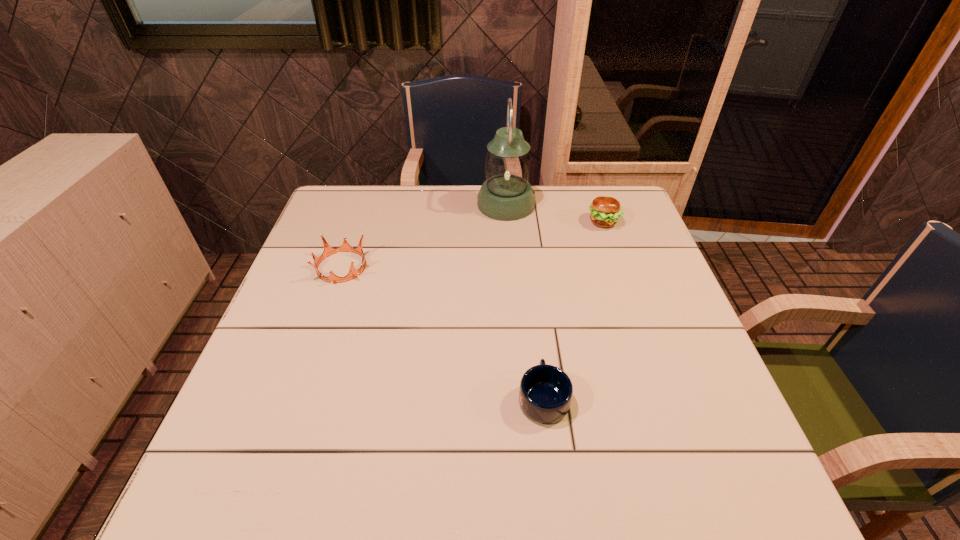
At what (x,y) coordinates should I click in order to perform the action: click on blank area located with the handle on the side of the mug. Please return your answer as a coordinate pair (x, y). The image size is (960, 540). Looking at the image, I should click on tap(533, 307).

Find the location of a particular element. vacant area situated with the handle on the side of the mug is located at coordinates (530, 285).

Locate an element on the screen. lantern that is at the far edge is located at coordinates (506, 195).

Find the location of a particular element. hamburger at the far edge is located at coordinates (605, 211).

Locate an element on the screen. object that is at the left edge is located at coordinates (345, 247).

In order to click on object located at the right edge in this screenshot , I will do `click(605, 211)`.

Image resolution: width=960 pixels, height=540 pixels. Identify the location of object at the far right corner. (605, 211).

Identify the location of free space at the far edge of the desktop. (547, 190).

You are a GUI agent. You are given a task and a screenshot of the screen. Output one action in this format:
    pyautogui.click(x=<x>, y=<y>)
    Task: Click on the vacant space at the near edge of the desktop
    This screenshot has height=540, width=960.
    Given the screenshot: What is the action you would take?
    pyautogui.click(x=564, y=465)

This screenshot has height=540, width=960. In the image, there is a desktop. Identify the location of vacant space at the left edge. [x=253, y=360].